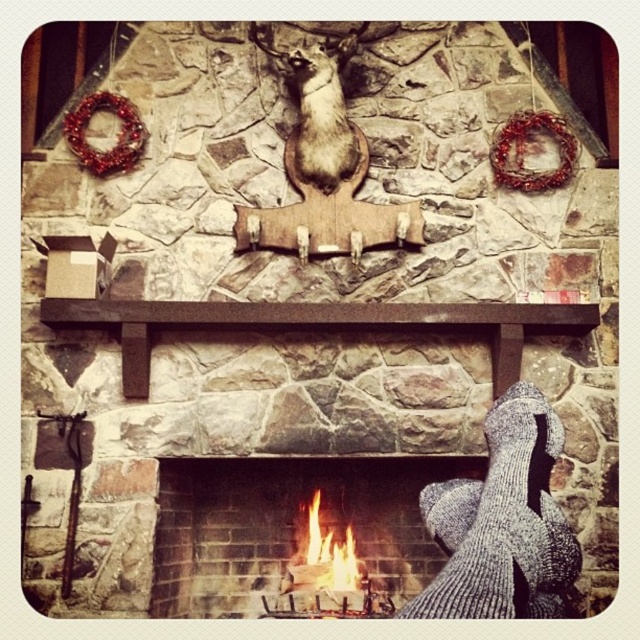
Does brick fireplace at center have a lesser width compared to flamewooden logs at lower center?

No.

Consider the image. Is brick fireplace at center smaller than flamewooden logs at lower center?

Incorrect, brick fireplace at center is not smaller in size than flamewooden logs at lower center.

Identify the location of brick fireplace at center. This screenshot has width=640, height=640. (285, 522).

Who is shorter, fuzzy brown ferret at center or flamewooden logs at lower center?

Standing shorter between the two is flamewooden logs at lower center.

Does point (324, 93) lie behind point (321, 561)?

No, it is not.

Does point (324, 113) come in front of point (300, 582)?

No, (324, 113) is behind (300, 582).

The image size is (640, 640). What are the coordinates of `fuzzy brown ferret at center` in the screenshot? It's located at pyautogui.click(x=323, y=115).

Is brick fireplace at center thinner than fuzzy brown ferret at center?

No.

Is brick fireplace at center to the left of fuzzy brown ferret at center from the viewer's perspective?

Yes, brick fireplace at center is to the left of fuzzy brown ferret at center.

What do you see at coordinates (285, 522) in the screenshot? I see `brick fireplace at center` at bounding box center [285, 522].

This screenshot has width=640, height=640. Find the location of `brick fireplace at center`. brick fireplace at center is located at coordinates (285, 522).